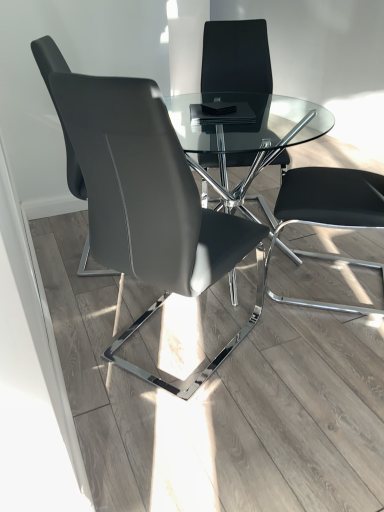
You are a GUI agent. You are given a task and a screenshot of the screen. Output one action in this format:
    pyautogui.click(x=<x>, y=<y>)
    Task: Click on the vacant region to the right of matte black chair at center, placed as the first chair when sorted from front to back
    
    Given the screenshot: What is the action you would take?
    pyautogui.click(x=304, y=358)